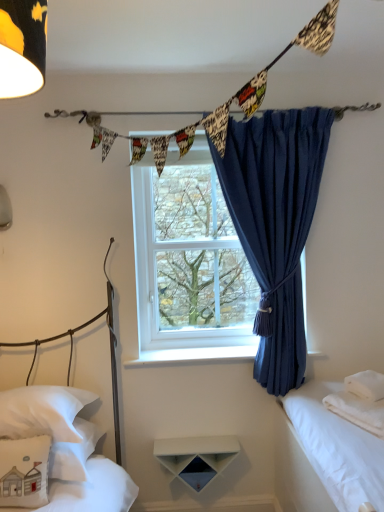
Question: Does printed fabric bunting at upper center, the 1th clothesline viewed from the back, have a smaller size compared to white cotton bed at right, acting as the 3th bed starting from the left?

Choices:
 (A) no
 (B) yes

Answer: (B)

Question: Is printed fabric bunting at upper center, the 1th clothesline viewed from the back, at the left side of white cotton bed at right, acting as the first bed starting from the right?

Choices:
 (A) yes
 (B) no

Answer: (A)

Question: Is printed fabric bunting at upper center, the 1th clothesline viewed from the back, further to the viewer compared to white cotton bed at right, acting as the first bed starting from the right?

Choices:
 (A) no
 (B) yes

Answer: (B)

Question: From a real-world perspective, is printed fabric bunting at upper center, the 1th clothesline viewed from the back, below white cotton bed at right, acting as the 3th bed starting from the left?

Choices:
 (A) yes
 (B) no

Answer: (B)

Question: Can you confirm if printed fabric bunting at upper center, which is the second clothesline in front-to-back order, is shorter than white cotton bed at right, acting as the 3th bed starting from the left?

Choices:
 (A) no
 (B) yes

Answer: (B)

Question: Can you confirm if printed fabric bunting at upper center, the 1th clothesline viewed from the back, is wider than white cotton bed at right, acting as the first bed starting from the right?

Choices:
 (A) no
 (B) yes

Answer: (A)

Question: Can you confirm if printed fabric bunting at upper center, the 1th clothesline viewed from the back, is taller than white fabric pillow at lower left, the first pillow positioned from the left?

Choices:
 (A) yes
 (B) no

Answer: (B)

Question: From the image's perspective, is printed fabric bunting at upper center, which is the second clothesline in front-to-back order, beneath white fabric pillow at lower left, which ranks as the 3th pillow in right-to-left order?

Choices:
 (A) no
 (B) yes

Answer: (A)

Question: Does printed fabric bunting at upper center, the 1th clothesline viewed from the back, have a larger size compared to white fabric pillow at lower left, which ranks as the 3th pillow in right-to-left order?

Choices:
 (A) no
 (B) yes

Answer: (A)

Question: Is printed fabric bunting at upper center, the 1th clothesline viewed from the back, turned away from white fabric pillow at lower left, the first pillow positioned from the left?

Choices:
 (A) yes
 (B) no

Answer: (B)

Question: Considering the relative positions of printed fabric bunting at upper center, which is the second clothesline in front-to-back order, and white fabric pillow at lower left, the first pillow positioned from the left, in the image provided, is printed fabric bunting at upper center, which is the second clothesline in front-to-back order, to the left of white fabric pillow at lower left, the first pillow positioned from the left, from the viewer's perspective?

Choices:
 (A) no
 (B) yes

Answer: (A)

Question: From a real-world perspective, is printed fabric bunting at upper center, the 1th clothesline viewed from the back, located beneath white fabric pillow at lower left, which ranks as the 3th pillow in right-to-left order?

Choices:
 (A) no
 (B) yes

Answer: (A)

Question: Considering the relative sizes of white soft towel at right and white soft pillow at right, which is the first pillow in right-to-left order, in the image provided, is white soft towel at right taller than white soft pillow at right, which is the first pillow in right-to-left order,?

Choices:
 (A) no
 (B) yes

Answer: (B)